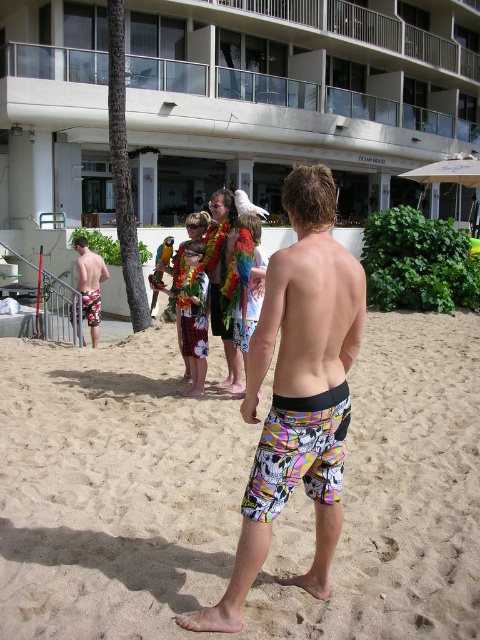
Who is more distant from viewer, (149,81) or (307,305)?

The point (149,81) is more distant.

Between point (385, 173) and point (288, 212), which one is positioned in front?

Point (288, 212) is more forward.

Is point (308, 70) behind point (252, 483)?

Yes, it is.

I want to click on white concrete building at center, so click(295, 97).

Does multicolored board shorts at center have a larger size compared to multicolored board shorts at left?

Actually, multicolored board shorts at center might be smaller than multicolored board shorts at left.

Is point (232, 209) positioned before point (97, 280)?

That is True.

The height and width of the screenshot is (640, 480). In order to click on multicolored board shorts at center in this screenshot , I will do `click(222, 280)`.

Can you confirm if multicolored printed shorts at center is smaller than multicolored board shorts at center?

Incorrect, multicolored printed shorts at center is not smaller in size than multicolored board shorts at center.

Between multicolored printed shorts at center and multicolored board shorts at center, which one is positioned higher?

multicolored board shorts at center is above.

Where is `multicolored printed shorts at center`? multicolored printed shorts at center is located at coordinates (235, 493).